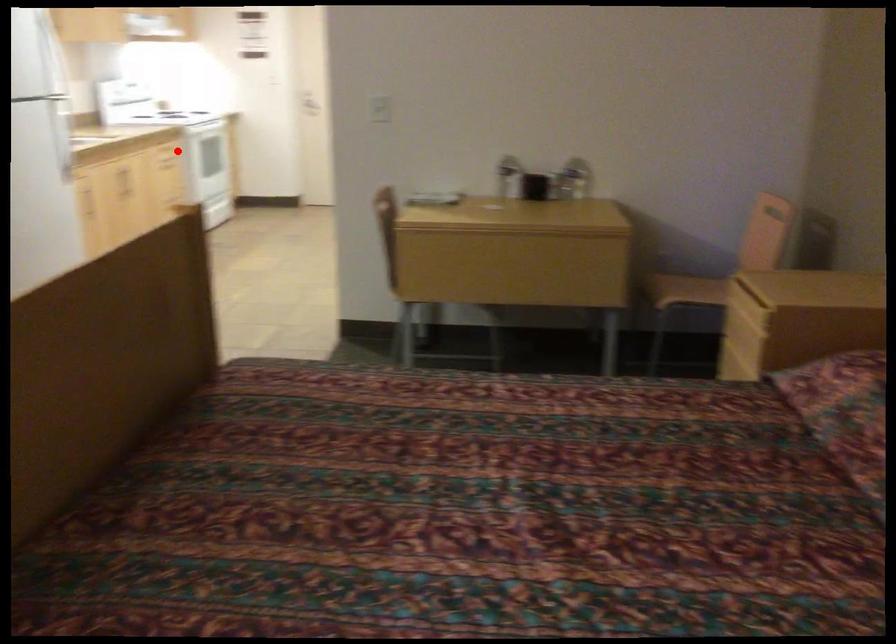
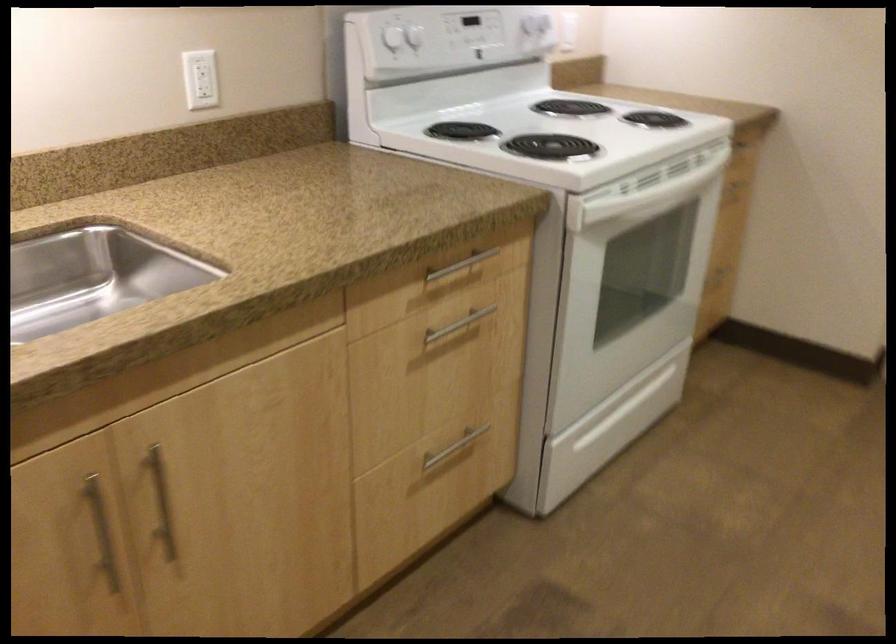
Find the pixel in the second image that matches the highlighted location in the first image.

(457, 325)